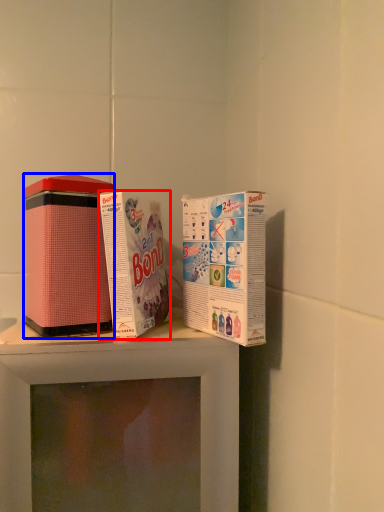
Question: Which object is further to the camera taking this photo, product (highlighted by a red box) or product (highlighted by a blue box)?

Choices:
 (A) product
 (B) product

Answer: (B)